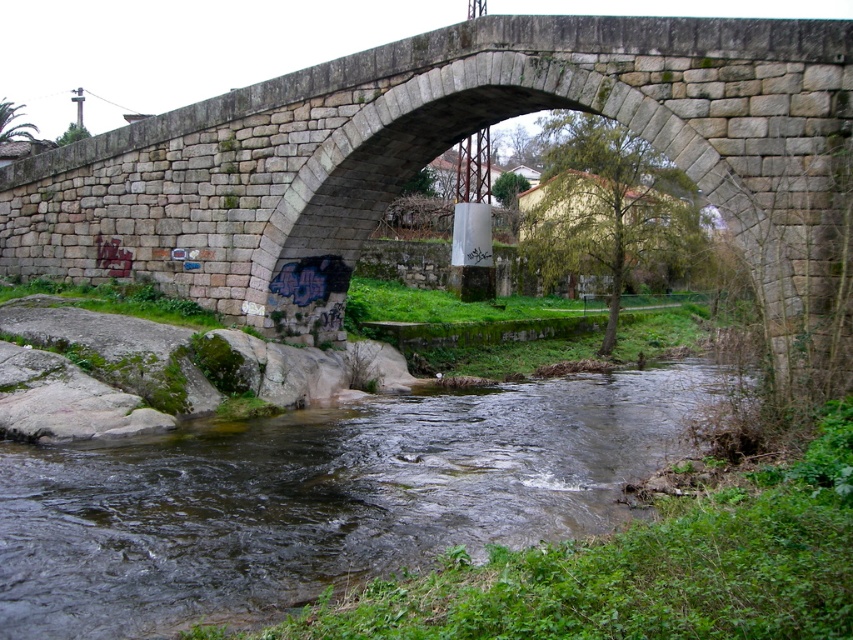
Question: Does gray stone bridge at center appear on the left side of clear water at center?

Choices:
 (A) yes
 (B) no

Answer: (A)

Question: Is the position of gray stone bridge at center more distant than that of clear water at center?

Choices:
 (A) no
 (B) yes

Answer: (B)

Question: Observing the image, what is the correct spatial positioning of gray stone bridge at center in reference to clear water at center?

Choices:
 (A) below
 (B) above

Answer: (B)

Question: Which point is closer to the camera taking this photo?

Choices:
 (A) (274, 566)
 (B) (622, 58)

Answer: (A)